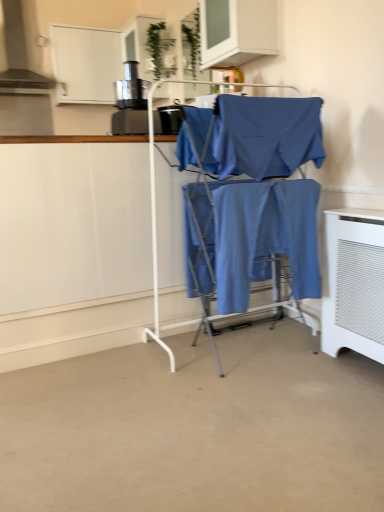
Question: From their relative heights in the image, would you say blue cotton fabric at center, which is the second fabric from bottom to top, is taller or shorter than white mesh radiator at lower right?

Choices:
 (A) short
 (B) tall

Answer: (A)

Question: From the image's perspective, relative to white mesh radiator at lower right, is blue cotton fabric at center, the first fabric in the top-to-bottom sequence, above or below?

Choices:
 (A) below
 (B) above

Answer: (B)

Question: Based on their relative distances, which object is farther from the white mesh radiator at lower right?

Choices:
 (A) white glossy cabinet at upper center
 (B) blue cotton pants at center, which is counted as the second fabric, starting from the top
 (C) blue cotton fabric at center, the first fabric in the top-to-bottom sequence
 (D) matte blue fabric at center
 (E) metallic black coffee machine at upper left

Answer: (E)

Question: Which of these objects is positioned closest to the blue cotton pants at center, which is counted as the second fabric, starting from the top?

Choices:
 (A) metallic black coffee machine at upper left
 (B) matte blue fabric at center
 (C) white mesh radiator at lower right
 (D) blue cotton fabric at center, the first fabric in the top-to-bottom sequence
 (E) white glossy cabinet at upper center

Answer: (D)